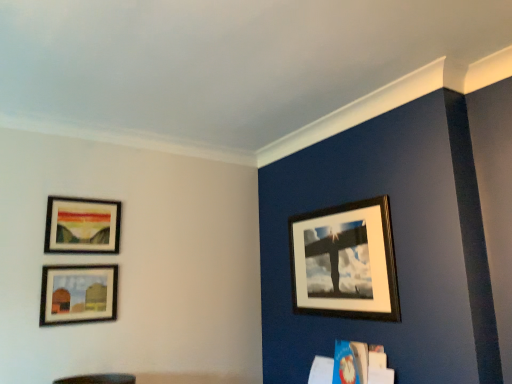
At what (x,y) coordinates should I click in order to perform the action: click on matte wooden picture frame at upper left, the 1th picture frame viewed from the left. Please return your answer as a coordinate pair (x, y). Looking at the image, I should click on 82,226.

In order to click on matte wooden picture frame at lower left, the 2th picture frame viewed from the left in this screenshot , I will do point(78,294).

From a real-world perspective, between matte wooden picture frame at lower left, the second picture frame in the right-to-left sequence, and matte wooden picture frame at upper left, the 1th picture frame viewed from the left, who is vertically lower?

In real-world perspective, matte wooden picture frame at lower left, the second picture frame in the right-to-left sequence, is lower.

From the image's perspective, is matte wooden picture frame at lower left, the second picture frame in the right-to-left sequence, above or below matte wooden picture frame at upper left, the 3th picture frame in the right-to-left sequence?

matte wooden picture frame at lower left, the second picture frame in the right-to-left sequence, is below matte wooden picture frame at upper left, the 3th picture frame in the right-to-left sequence.

Is matte wooden picture frame at lower left, the second picture frame in the right-to-left sequence, completely or partially outside of matte wooden picture frame at upper left, the 3th picture frame in the right-to-left sequence?

That's correct, matte wooden picture frame at lower left, the second picture frame in the right-to-left sequence, is outside of matte wooden picture frame at upper left, the 3th picture frame in the right-to-left sequence.

Based on their sizes in the image, would you say matte wooden picture frame at lower left, the 2th picture frame viewed from the left, is bigger or smaller than matte wooden picture frame at upper left, the 3th picture frame in the right-to-left sequence?

Considering their sizes, matte wooden picture frame at lower left, the 2th picture frame viewed from the left, takes up less space than matte wooden picture frame at upper left, the 3th picture frame in the right-to-left sequence.

How many degrees apart are the facing directions of matte wooden picture frame at upper left, the 1th picture frame viewed from the left, and wooden picture frame at upper right, the 3th picture frame viewed from the left?

90 degrees separate the facing orientations of matte wooden picture frame at upper left, the 1th picture frame viewed from the left, and wooden picture frame at upper right, the 3th picture frame viewed from the left.

Who is smaller, matte wooden picture frame at upper left, the 3th picture frame in the right-to-left sequence, or wooden picture frame at upper right, the 1th picture frame positioned from the right?

With smaller size is matte wooden picture frame at upper left, the 3th picture frame in the right-to-left sequence.

Does point (88, 208) appear closer or farther from the camera than point (366, 306)?

Point (88, 208) appears to be farther away from the viewer than point (366, 306).

Does matte wooden picture frame at upper left, the 1th picture frame viewed from the left, have a lesser height compared to wooden picture frame at upper right, the 1th picture frame positioned from the right?

Correct, matte wooden picture frame at upper left, the 1th picture frame viewed from the left, is not as tall as wooden picture frame at upper right, the 1th picture frame positioned from the right.

From a real-world perspective, between matte wooden picture frame at lower left, the 2th picture frame viewed from the left, and wooden picture frame at upper right, the 3th picture frame viewed from the left, who is vertically lower?

matte wooden picture frame at lower left, the 2th picture frame viewed from the left.

Considering the sizes of objects matte wooden picture frame at lower left, the second picture frame in the right-to-left sequence, and wooden picture frame at upper right, the 1th picture frame positioned from the right, in the image provided, who is wider, matte wooden picture frame at lower left, the second picture frame in the right-to-left sequence, or wooden picture frame at upper right, the 1th picture frame positioned from the right,?

With larger width is wooden picture frame at upper right, the 1th picture frame positioned from the right.

Can you confirm if matte wooden picture frame at lower left, the second picture frame in the right-to-left sequence, is positioned to the left of wooden picture frame at upper right, the 1th picture frame positioned from the right?

Yes, matte wooden picture frame at lower left, the second picture frame in the right-to-left sequence, is to the left of wooden picture frame at upper right, the 1th picture frame positioned from the right.

Can wooden picture frame at upper right, the 3th picture frame viewed from the left, be found inside matte wooden picture frame at lower left, the second picture frame in the right-to-left sequence?

No, wooden picture frame at upper right, the 3th picture frame viewed from the left, is not surrounded by matte wooden picture frame at lower left, the second picture frame in the right-to-left sequence.

Based on the photo, is matte wooden picture frame at upper left, the 1th picture frame viewed from the left, positioned beyond the bounds of matte wooden picture frame at lower left, the second picture frame in the right-to-left sequence?

Yes.

From a real-world perspective, which is physically below, matte wooden picture frame at upper left, the 3th picture frame in the right-to-left sequence, or matte wooden picture frame at lower left, the second picture frame in the right-to-left sequence?

From a 3D spatial view, matte wooden picture frame at lower left, the second picture frame in the right-to-left sequence, is below.

Which of these two, matte wooden picture frame at upper left, the 3th picture frame in the right-to-left sequence, or matte wooden picture frame at lower left, the second picture frame in the right-to-left sequence, is bigger?

matte wooden picture frame at upper left, the 3th picture frame in the right-to-left sequence.

Considering the relative positions of wooden picture frame at upper right, the 3th picture frame viewed from the left, and matte wooden picture frame at lower left, the 2th picture frame viewed from the left, in the image provided, is wooden picture frame at upper right, the 3th picture frame viewed from the left, behind matte wooden picture frame at lower left, the 2th picture frame viewed from the left,?

No, wooden picture frame at upper right, the 3th picture frame viewed from the left, is closer to the viewer.

From the image's perspective, which is above, wooden picture frame at upper right, the 1th picture frame positioned from the right, or matte wooden picture frame at lower left, the 2th picture frame viewed from the left?

wooden picture frame at upper right, the 1th picture frame positioned from the right, appears higher in the image.

Considering the relative sizes of wooden picture frame at upper right, the 3th picture frame viewed from the left, and matte wooden picture frame at lower left, the second picture frame in the right-to-left sequence, in the image provided, is wooden picture frame at upper right, the 3th picture frame viewed from the left, bigger than matte wooden picture frame at lower left, the second picture frame in the right-to-left sequence,?

Yes.

Is wooden picture frame at upper right, the 3th picture frame viewed from the left, next to matte wooden picture frame at lower left, the 2th picture frame viewed from the left?

No, wooden picture frame at upper right, the 3th picture frame viewed from the left, is not next to matte wooden picture frame at lower left, the 2th picture frame viewed from the left.

From the image's perspective, would you say wooden picture frame at upper right, the 1th picture frame positioned from the right, is positioned over matte wooden picture frame at upper left, the 1th picture frame viewed from the left?

No, from the image's perspective, wooden picture frame at upper right, the 1th picture frame positioned from the right, is not on top of matte wooden picture frame at upper left, the 1th picture frame viewed from the left.

Between point (325, 248) and point (50, 245), which one is positioned in front?

The point (50, 245) is closer to the camera.

Does wooden picture frame at upper right, the 1th picture frame positioned from the right, appear on the left side of matte wooden picture frame at upper left, the 1th picture frame viewed from the left?

Incorrect, wooden picture frame at upper right, the 1th picture frame positioned from the right, is not on the left side of matte wooden picture frame at upper left, the 1th picture frame viewed from the left.

What are the coordinates of `picture frame that is the 1st object to the right of the matte wooden picture frame at upper left, the 3th picture frame in the right-to-left sequence, starting at the anchor` in the screenshot? It's located at (78, 294).

I want to click on picture frame above the wooden picture frame at upper right, the 1th picture frame positioned from the right (from a real-world perspective), so click(82, 226).

Based on their spatial positions, is matte wooden picture frame at upper left, the 1th picture frame viewed from the left, or wooden picture frame at upper right, the 1th picture frame positioned from the right, closer to matte wooden picture frame at lower left, the 2th picture frame viewed from the left?

The object closer to matte wooden picture frame at lower left, the 2th picture frame viewed from the left, is matte wooden picture frame at upper left, the 1th picture frame viewed from the left.

Considering their positions, is wooden picture frame at upper right, the 3th picture frame viewed from the left, positioned closer to matte wooden picture frame at upper left, the 3th picture frame in the right-to-left sequence, than matte wooden picture frame at lower left, the second picture frame in the right-to-left sequence?

Among the two, matte wooden picture frame at lower left, the second picture frame in the right-to-left sequence, is located nearer to matte wooden picture frame at upper left, the 3th picture frame in the right-to-left sequence.

Looking at the image, which one is located further to matte wooden picture frame at lower left, the second picture frame in the right-to-left sequence, wooden picture frame at upper right, the 3th picture frame viewed from the left, or matte wooden picture frame at upper left, the 3th picture frame in the right-to-left sequence?

wooden picture frame at upper right, the 3th picture frame viewed from the left, lies further to matte wooden picture frame at lower left, the second picture frame in the right-to-left sequence, than the other object.

Looking at the image, which one is located closer to wooden picture frame at upper right, the 3th picture frame viewed from the left, matte wooden picture frame at lower left, the 2th picture frame viewed from the left, or matte wooden picture frame at upper left, the 1th picture frame viewed from the left?

The object closer to wooden picture frame at upper right, the 3th picture frame viewed from the left, is matte wooden picture frame at lower left, the 2th picture frame viewed from the left.

From the image, which object appears to be farther from matte wooden picture frame at upper left, the 1th picture frame viewed from the left, matte wooden picture frame at lower left, the second picture frame in the right-to-left sequence, or wooden picture frame at upper right, the 1th picture frame positioned from the right?

The object further to matte wooden picture frame at upper left, the 1th picture frame viewed from the left, is wooden picture frame at upper right, the 1th picture frame positioned from the right.

From the image, which object appears to be farther from wooden picture frame at upper right, the 1th picture frame positioned from the right, matte wooden picture frame at upper left, the 3th picture frame in the right-to-left sequence, or matte wooden picture frame at lower left, the 2th picture frame viewed from the left?

Among the two, matte wooden picture frame at upper left, the 3th picture frame in the right-to-left sequence, is located further to wooden picture frame at upper right, the 1th picture frame positioned from the right.

You are a GUI agent. You are given a task and a screenshot of the screen. Output one action in this format:
    pyautogui.click(x=<x>, y=<y>)
    Task: Click on the picture frame between matte wooden picture frame at upper left, the 3th picture frame in the right-to-left sequence, and wooden picture frame at upper right, the 1th picture frame positioned from the right, in the horizontal direction
    This screenshot has height=384, width=512.
    Given the screenshot: What is the action you would take?
    pyautogui.click(x=78, y=294)